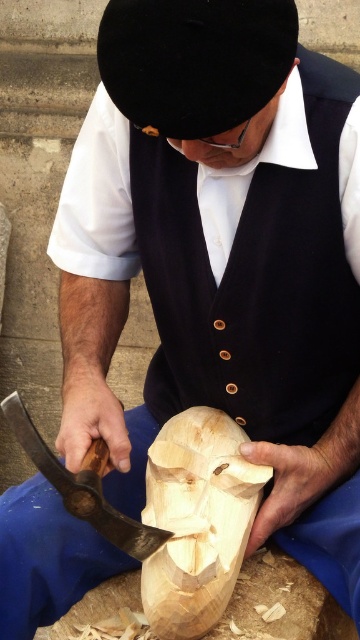
Between black velvet hat at upper center and natural wood mask at center, which one appears on the left side from the viewer's perspective?

From the viewer's perspective, black velvet hat at upper center appears more on the left side.

Who is more forward, (x=108, y=54) or (x=203, y=536)?

Point (x=108, y=54) is more forward.

Measure the distance between black velvet hat at upper center and camera.

3.43 feet

Where is `black velvet hat at upper center`? Image resolution: width=360 pixels, height=640 pixels. black velvet hat at upper center is located at coordinates 195,61.

Who is shorter, black velvet hat at upper center or wooden axe at center?

black velvet hat at upper center

Find the location of a particular element. The width and height of the screenshot is (360, 640). black velvet hat at upper center is located at coordinates (195, 61).

Between point (190, 138) and point (135, 532), which one is positioned behind?

The point (135, 532) is behind.

Identify the location of black velvet hat at upper center. (195, 61).

Does navy blue fabric vest at center appear over wooden axe at center?

Yes, navy blue fabric vest at center is above wooden axe at center.

Based on the photo, which is above, navy blue fabric vest at center or wooden axe at center?

navy blue fabric vest at center is higher up.

Who is more forward, [259,284] or [90,513]?

Point [90,513] is more forward.

What are the coordinates of `navy blue fabric vest at center` in the screenshot? It's located at (254, 280).